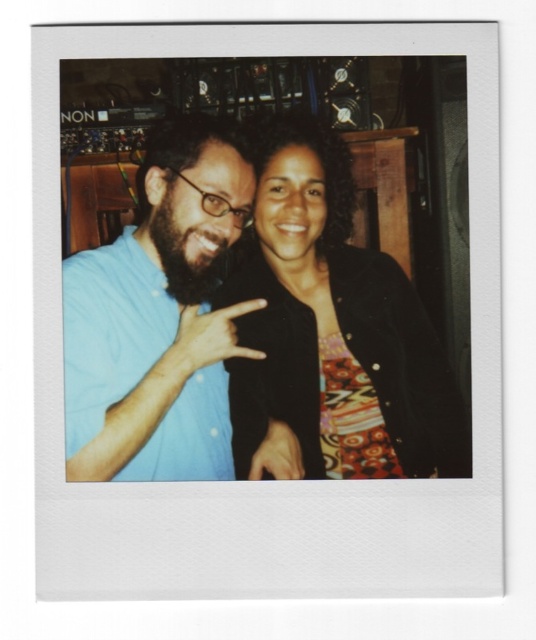
You are trying to decide which clothing item to take with you on a trip. You have limited space in your bag. Based on the image, which clothing item between the black textured jacket at center and the blue cotton shirt at center is wider and might take up more room?

The black textured jacket at center is wider than the blue cotton shirt at center, so it would take up more space in the bag.

You are a photographer adjusting the lighting in the room. You notice the black textured jacket at center and the blue cotton shirt at center. Which object is positioned lower in the image?

The black textured jacket at center is positioned lower than the blue cotton shirt at center in the image.